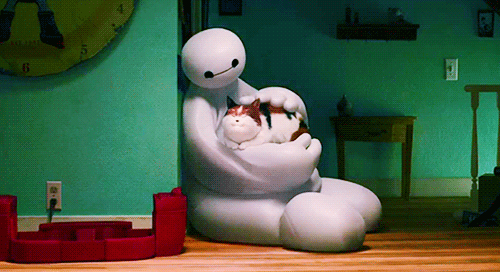
The width and height of the screenshot is (500, 272). Find the location of `plug`. plug is located at coordinates (53, 205).